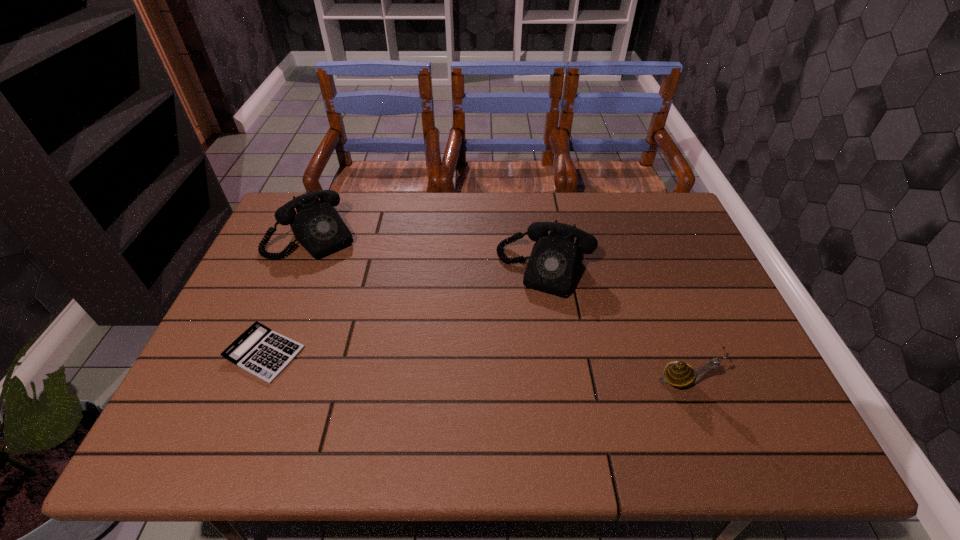
The height and width of the screenshot is (540, 960). In order to click on vacant space on the desktop that is between the calculator and the snail and is positioned on the dial of the third object from left to right in this screenshot , I will do `click(503, 369)`.

You are a GUI agent. You are given a task and a screenshot of the screen. Output one action in this format:
    pyautogui.click(x=<x>, y=<y>)
    Task: Click on the vacant space on the desktop that is between the shortest object and the snail and is positioned on the dial of the left telephone
    Image resolution: width=960 pixels, height=540 pixels.
    Given the screenshot: What is the action you would take?
    pyautogui.click(x=415, y=363)